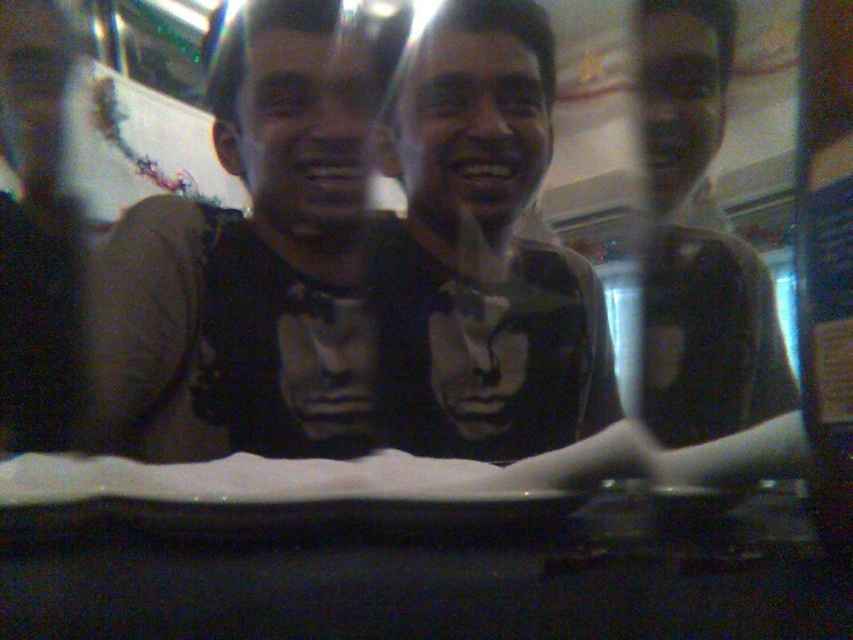
Question: Which point is farther to the camera?

Choices:
 (A) (399, 99)
 (B) (660, 426)
 (C) (653, 564)

Answer: (B)

Question: From the image, what is the correct spatial relationship of matte black t-shirt at center in relation to matte black shirt at center?

Choices:
 (A) above
 (B) below

Answer: (B)

Question: Does black plastic table at lower center have a smaller size compared to matte black t-shirt at center?

Choices:
 (A) yes
 (B) no

Answer: (A)

Question: Which object is positioned closest to the matte black shirt at center?

Choices:
 (A) black plastic table at lower center
 (B) matte black t-shirt at center

Answer: (B)

Question: Which object appears farthest from the camera in this image?

Choices:
 (A) matte black t-shirt at center
 (B) matte black bow tie at center

Answer: (A)

Question: From the image, what is the correct spatial relationship of matte black t-shirt at center in relation to matte black shirt at center?

Choices:
 (A) below
 (B) above

Answer: (A)